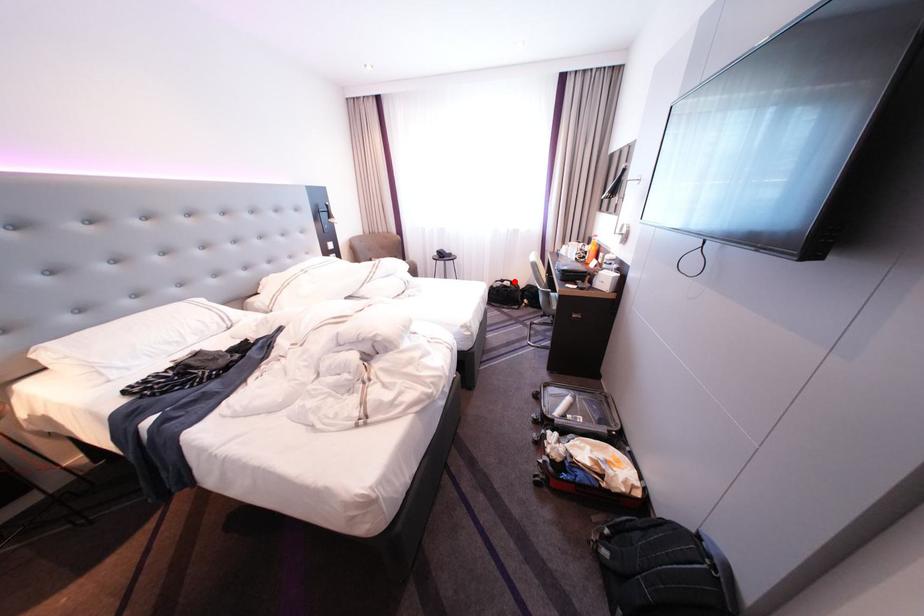
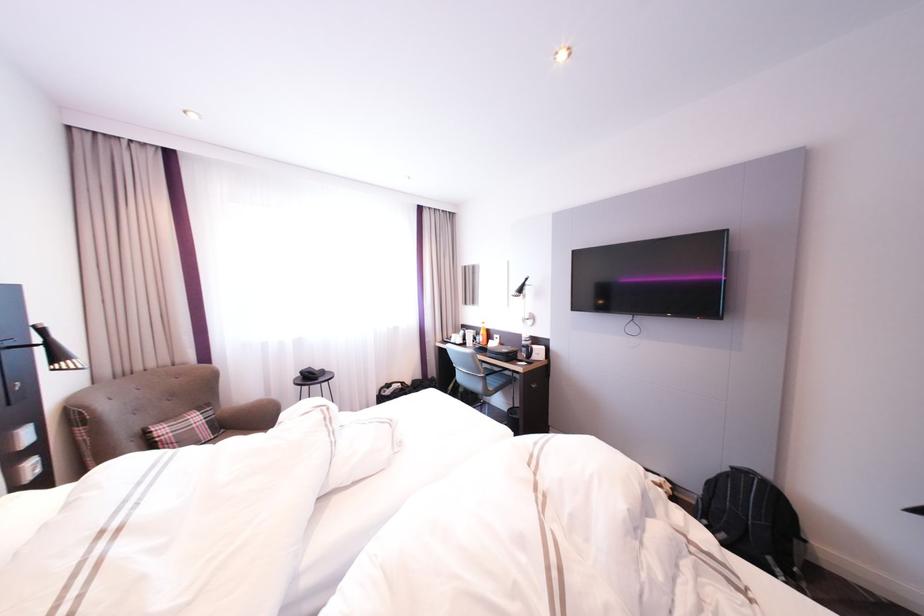
The point at the highlighted location is marked in the first image. Where is the corresponding point in the second image?

(400, 386)